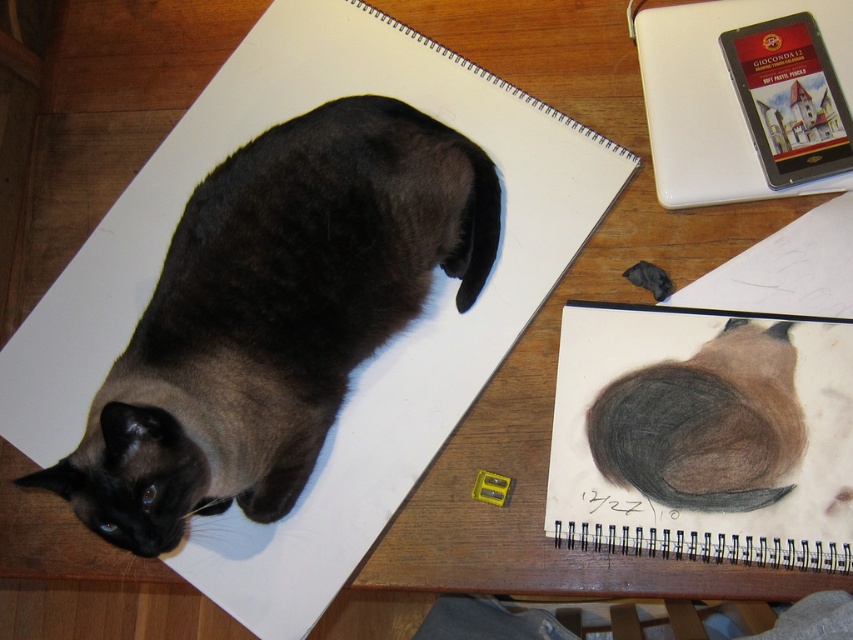
You are an artist who wants to draw the cat without disturbing it. The cat is sitting at point (x=276, y=314). The sketchpad is at the center of the table. If you move your hand from the edge of the table towards the center, will you accidentally touch the cat?

The point (x=276, y=314) where the dark brown fur cat at upper left is located is to the upper left of the sketchpad at the center. Moving your hand from the edge of the table toward the center would not go near the cat, so you can safely draw without touching it.

You are holding a laser pointer and want to shine it on the point at coordinates point (679, 396). If the laser pointer can reach up to 30 inches, will it be able to reach that point?

The point (679, 396) is 33.37 inches away from the viewer, which is beyond the laser pointer range of 30 inches. Therefore, the laser pointer cannot reach the point.